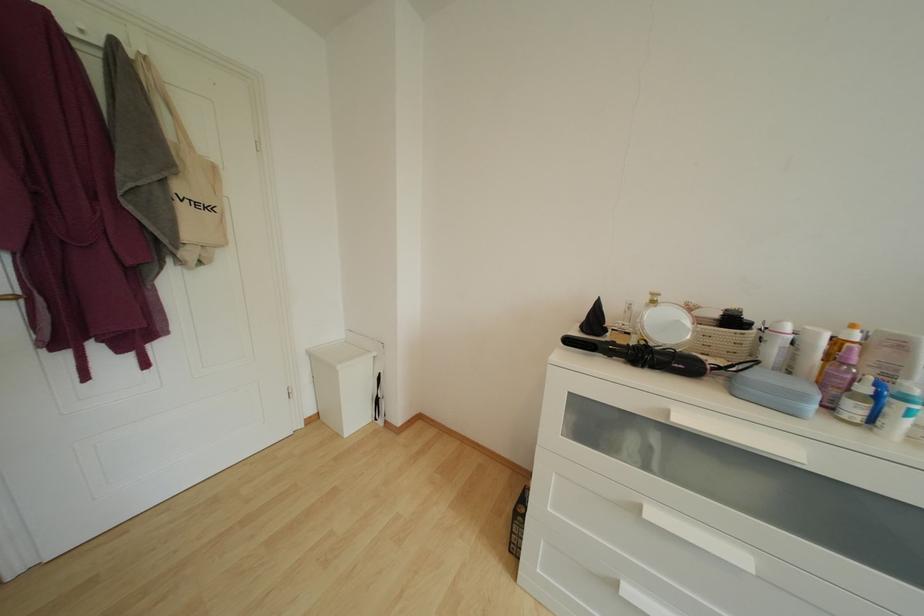
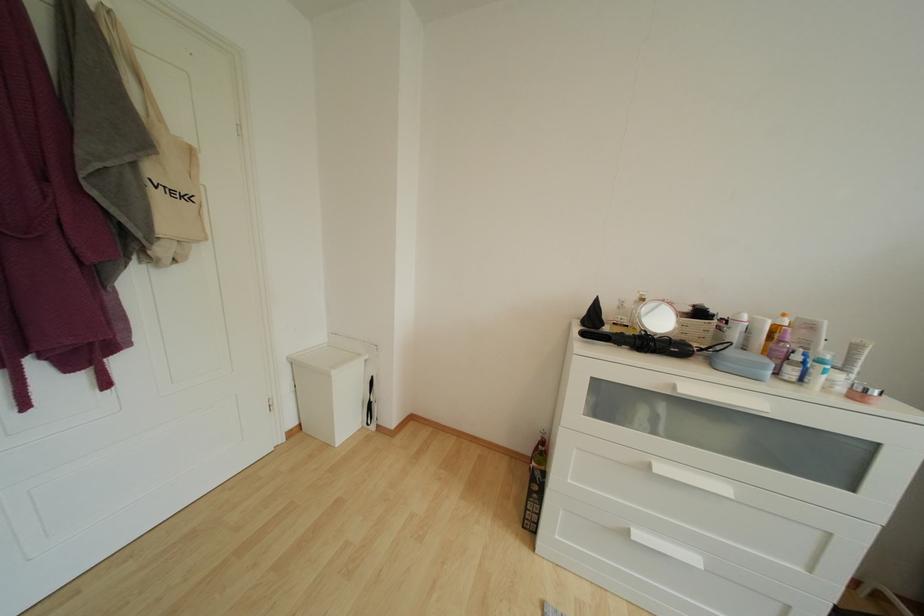
Find the pixel in the second image that matches (x=673, y=416) in the first image.

(678, 391)